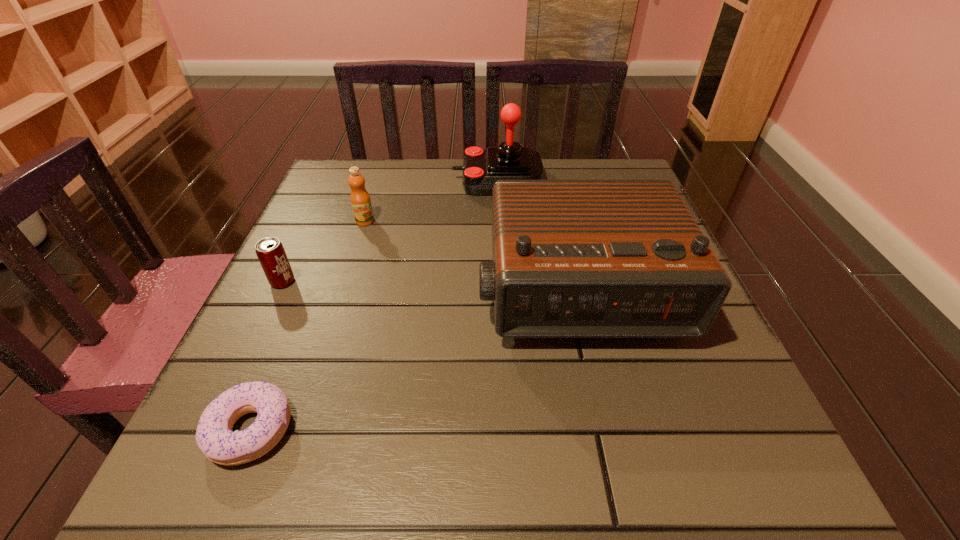
The image size is (960, 540). What are the coordinates of `free region located on the tuning display of the radio receiver` in the screenshot? It's located at (596, 378).

The width and height of the screenshot is (960, 540). Find the location of `free location located 0.070m on the front label of the third tallest object`. free location located 0.070m on the front label of the third tallest object is located at coordinates (357, 247).

Find the location of a particular element. The height and width of the screenshot is (540, 960). free space located 0.150m on the front of the second shortest object is located at coordinates (248, 355).

Locate an element on the screen. This screenshot has height=540, width=960. free space located 0.390m on the back of the shortest object is located at coordinates (330, 235).

At what (x,y) coordinates should I click in order to perform the action: click on object that is at the far edge. Please return your answer as a coordinate pair (x, y). Looking at the image, I should click on (481, 168).

Locate an element on the screen. This screenshot has width=960, height=540. object present at the near edge is located at coordinates (214, 436).

Identify the location of orange juice that is at the left edge. This screenshot has height=540, width=960. (360, 200).

This screenshot has width=960, height=540. Identify the location of beer can at the left edge. point(271,254).

The width and height of the screenshot is (960, 540). Find the location of `doughnut present at the left edge`. doughnut present at the left edge is located at coordinates (214, 436).

This screenshot has width=960, height=540. Find the location of `object that is at the right edge`. object that is at the right edge is located at coordinates (571, 258).